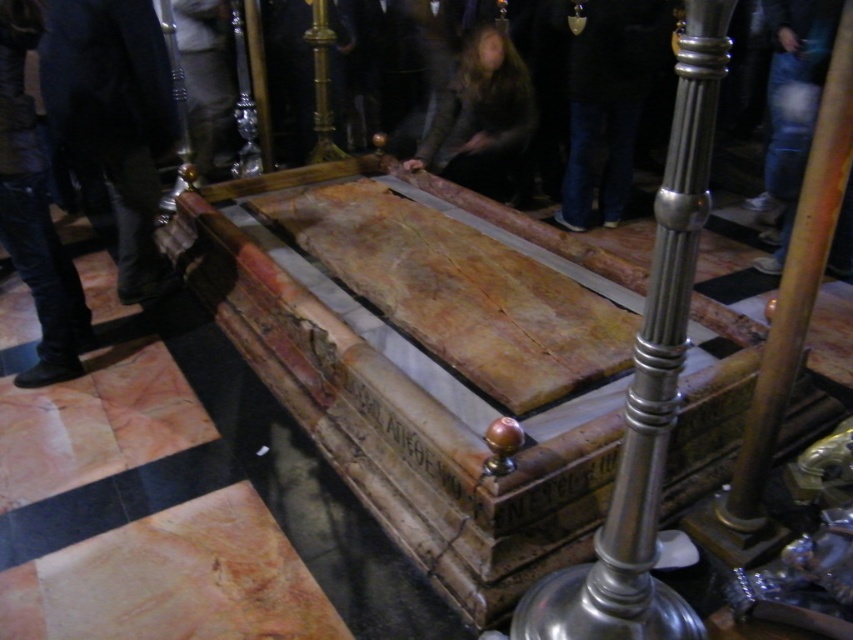
Question: Can you confirm if dark blue jeans at lower left is positioned above dark brown leather jacket at center?

Choices:
 (A) yes
 (B) no

Answer: (B)

Question: Where is dark blue jeans at lower left located in relation to dark brown leather jacket at center in the image?

Choices:
 (A) right
 (B) left

Answer: (B)

Question: Where is dark blue jeans at lower left located in relation to dark brown leather jacket at center in the image?

Choices:
 (A) below
 (B) above

Answer: (A)

Question: Which of the following is the farthest from the observer?

Choices:
 (A) (149, 141)
 (B) (502, 86)

Answer: (B)